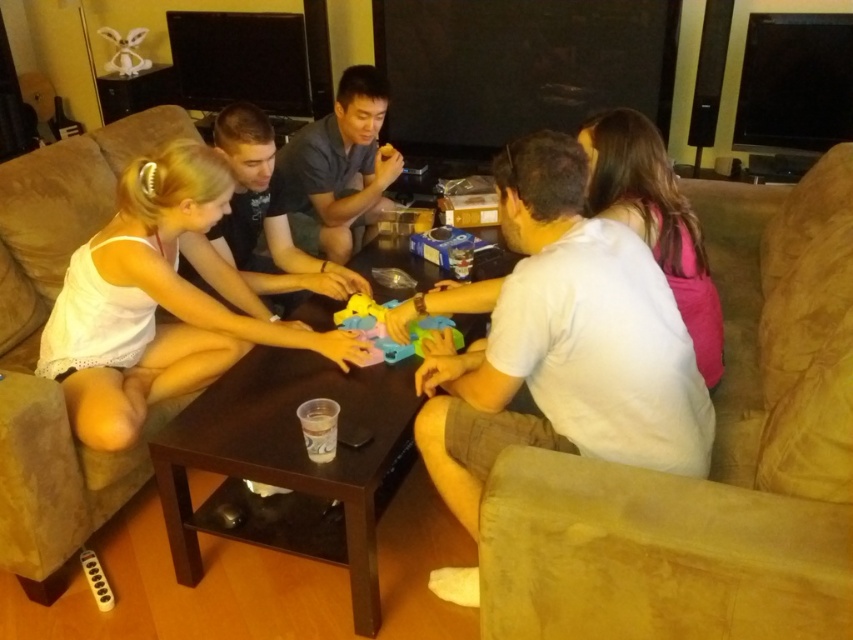
Question: Does suede couch at lower right have a greater width compared to brown wooden table at center?

Choices:
 (A) yes
 (B) no

Answer: (A)

Question: Considering the real-world distances, which object is closest to the suede couch at lower right?

Choices:
 (A) suede couch at lower left
 (B) white fabric dress at center

Answer: (B)

Question: Among these objects, which one is nearest to the camera?

Choices:
 (A) brown wooden table at center
 (B) white fabric dress at center
 (C) white cotton shirt at center
 (D) rubberized plastic toy at center

Answer: (C)

Question: Is white fabric dress at center thinner than suede couch at lower left?

Choices:
 (A) yes
 (B) no

Answer: (B)

Question: Is suede couch at lower right bigger than suede couch at lower left?

Choices:
 (A) yes
 (B) no

Answer: (A)

Question: Which of these objects is positioned farthest from the suede couch at lower right?

Choices:
 (A) suede couch at lower left
 (B) rubberized plastic toy at center
 (C) brown wooden table at center

Answer: (A)